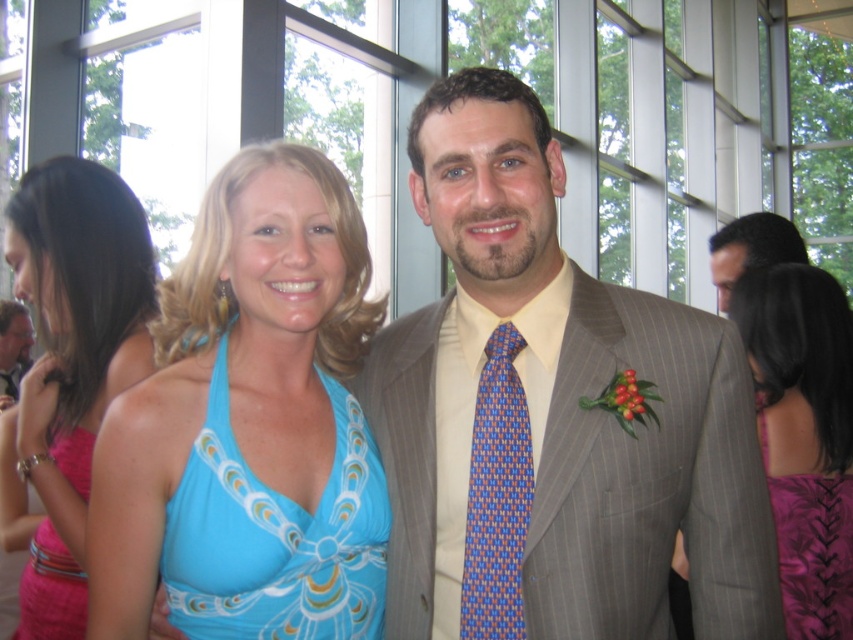
Question: Observing the image, what is the correct spatial positioning of matte blue dress at center in reference to blue printed fabric dress at center?

Choices:
 (A) below
 (B) above

Answer: (B)

Question: Does blue halter top at center appear on the left side of matte black suit at center?

Choices:
 (A) yes
 (B) no

Answer: (B)

Question: Among these objects, which one is farthest from the camera?

Choices:
 (A) matte blue dress at center
 (B) purple floral dress at lower right
 (C) matte black suit at center
 (D) blue printed fabric dress at center

Answer: (C)

Question: Can you confirm if gray pinstripe suit at center is thinner than purple floral dress at lower right?

Choices:
 (A) yes
 (B) no

Answer: (B)

Question: Considering the real-world distances, which object is closest to the purple satin dress at lower right?

Choices:
 (A) purple floral dress at lower right
 (B) pink satin dress at lower left
 (C) matte blue dress at center

Answer: (A)

Question: Which point is closer to the camera?

Choices:
 (A) (686, 436)
 (B) (758, 401)

Answer: (A)